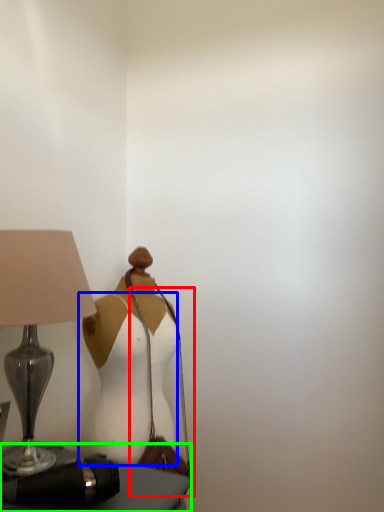
Question: Considering the real-world distances, which object is farthest from shoulder bag (highlighted by a red box)? fancy dress (highlighted by a blue box) or furniture (highlighted by a green box)?

Choices:
 (A) fancy dress
 (B) furniture

Answer: (B)